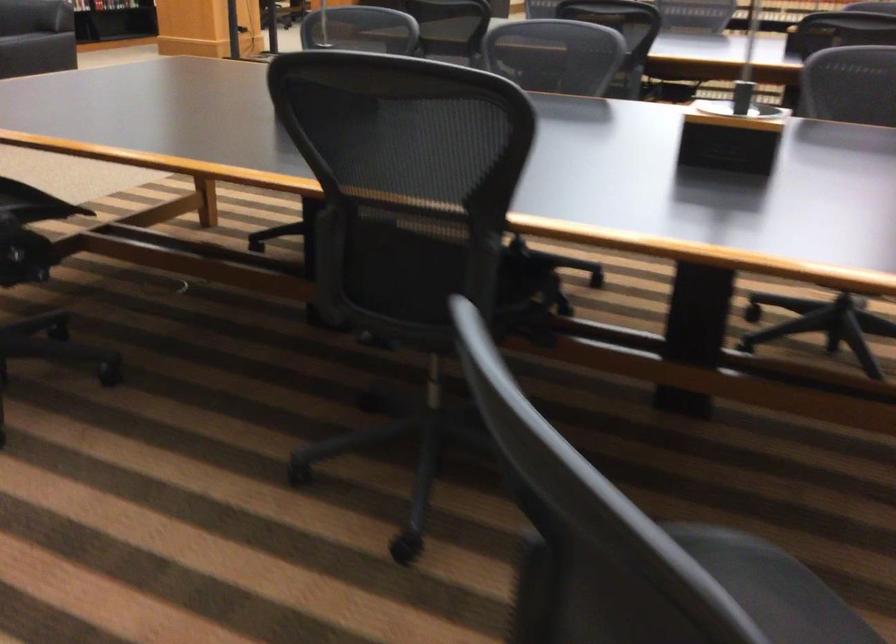
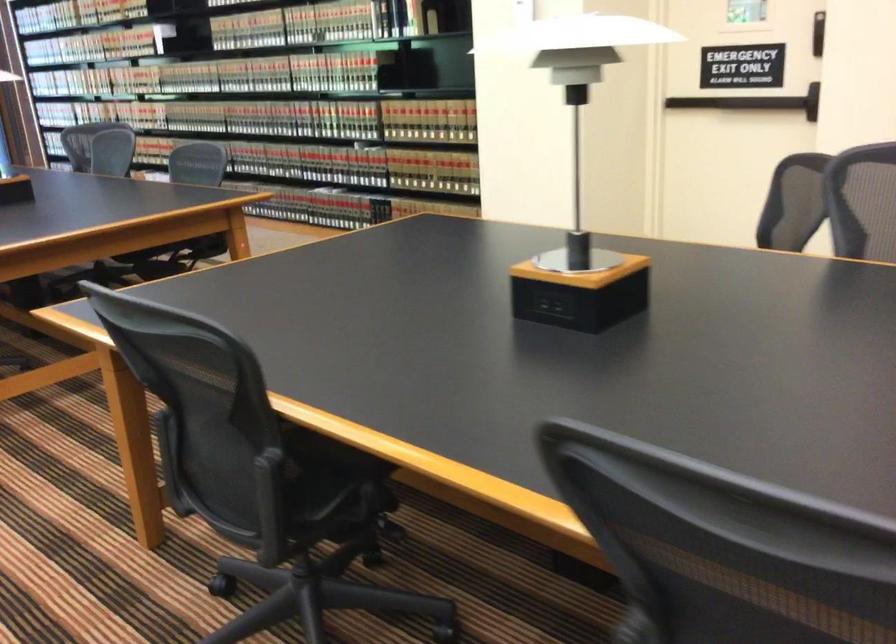
Question: I am providing you with two images of the same scene from different viewpoints. Which of the following objects are not visible in image2?

Choices:
 (A) gray hair dryer
 (B) chair sitting surface
 (C) black power outlet
 (D) black door handle

Answer: (B)